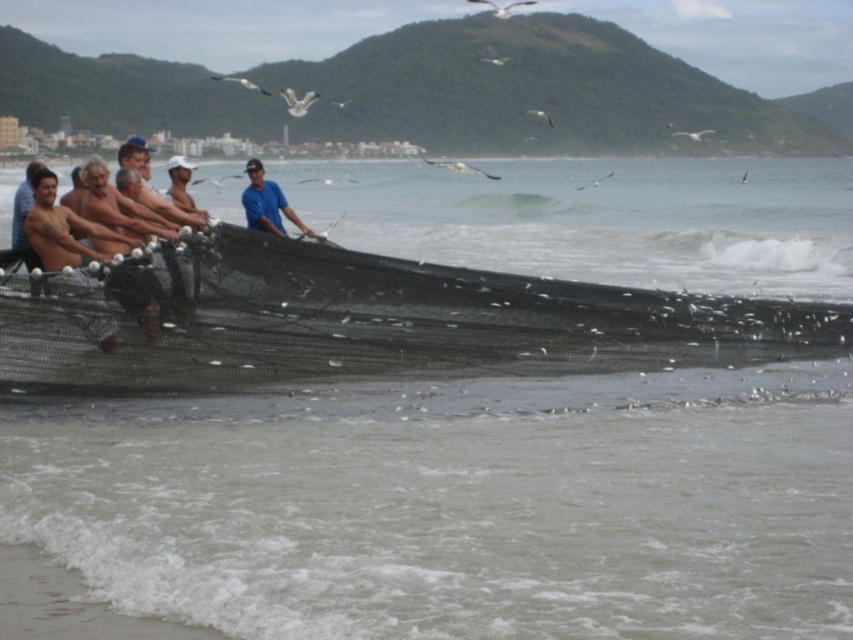
Question: Does black mesh net at center have a smaller size compared to smooth skin torso at left?

Choices:
 (A) no
 (B) yes

Answer: (B)

Question: Among these points, which one is nearest to the camera?

Choices:
 (A) (299, 220)
 (B) (805, 321)

Answer: (B)

Question: Estimate the real-world distances between objects in this image. Which object is farther from the blue matte shirt at center?

Choices:
 (A) smooth skin torso at left
 (B) black mesh net at center

Answer: (B)

Question: In this image, where is black mesh net at center located relative to blue matte shirt at center?

Choices:
 (A) below
 (B) above

Answer: (A)

Question: Does black mesh net at center have a larger size compared to smooth skin torso at left?

Choices:
 (A) yes
 (B) no

Answer: (B)

Question: Which of the following is the farthest from the observer?

Choices:
 (A) black mesh net at center
 (B) smooth skin torso at left
 (C) blue matte shirt at center

Answer: (C)